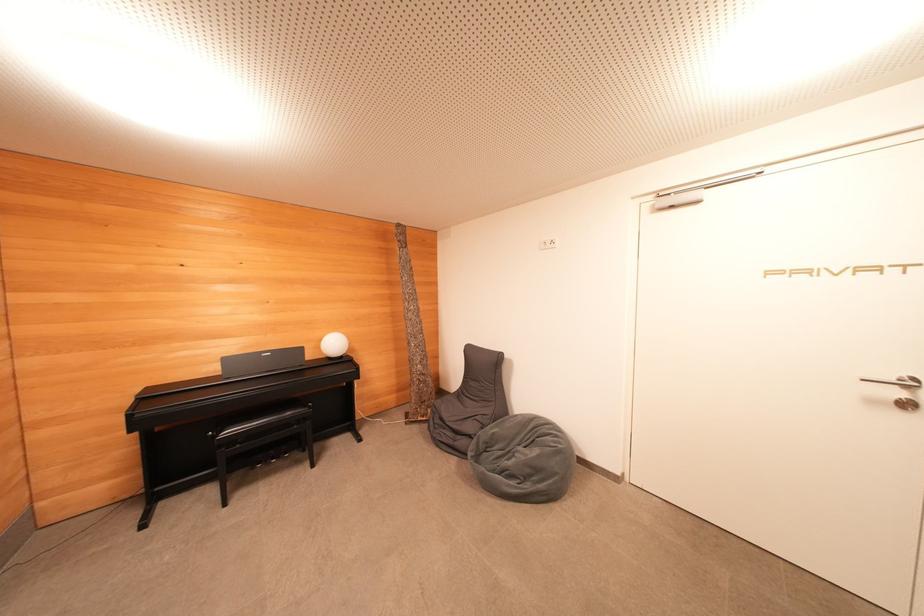
At what (x,y) coordinates should I click in order to perform the action: click on black chair sitting surface. Please return your answer as a coordinate pair (x, y). Image resolution: width=924 pixels, height=616 pixels. Looking at the image, I should click on (271, 419).